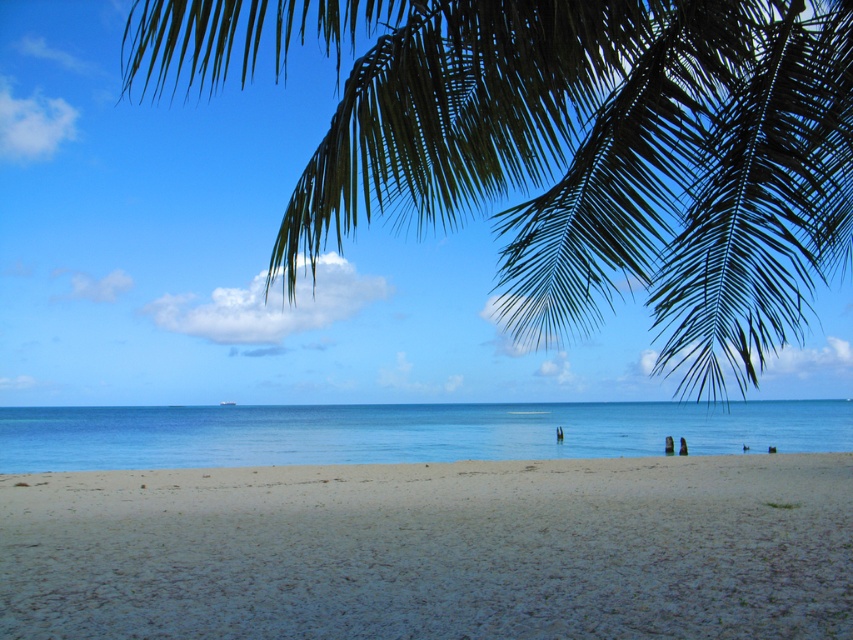
Does light brown sandy beach at lower center appear under blue water at center?

Yes, light brown sandy beach at lower center is below blue water at center.

Can you confirm if light brown sandy beach at lower center is taller than blue water at center?

Incorrect, light brown sandy beach at lower center's height is not larger of blue water at center's.

What do you see at coordinates (434, 548) in the screenshot? Image resolution: width=853 pixels, height=640 pixels. I see `light brown sandy beach at lower center` at bounding box center [434, 548].

Locate an element on the screen. This screenshot has width=853, height=640. light brown sandy beach at lower center is located at coordinates (434, 548).

Is green leafy palm at upper center shorter than blue water at center?

Incorrect, green leafy palm at upper center's height does not fall short of blue water at center's.

Does point (816, 211) come behind point (285, 422)?

No, (816, 211) is in front of (285, 422).

The width and height of the screenshot is (853, 640). I want to click on green leafy palm at upper center, so click(x=572, y=148).

Is green leafy palm at upper center bigger than light brown sandy beach at lower center?

Yes, green leafy palm at upper center is bigger than light brown sandy beach at lower center.

From the picture: Can you confirm if green leafy palm at upper center is positioned below light brown sandy beach at lower center?

Incorrect, green leafy palm at upper center is not positioned below light brown sandy beach at lower center.

Between point (422, 220) and point (36, 529), which one is positioned behind?

The point (422, 220) is more distant.

Locate an element on the screen. This screenshot has height=640, width=853. green leafy palm at upper center is located at coordinates (572, 148).